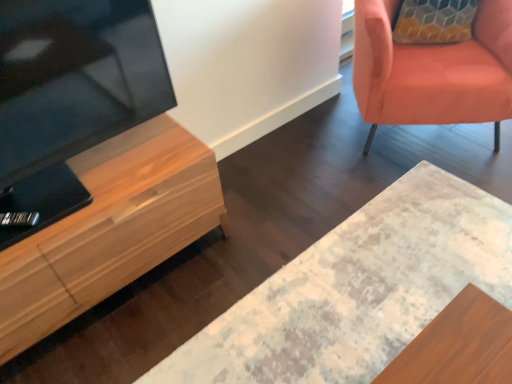
Locate an element on the screen. The height and width of the screenshot is (384, 512). free space between matte orange chair at upper right and distressed wood desk at center is located at coordinates (311, 200).